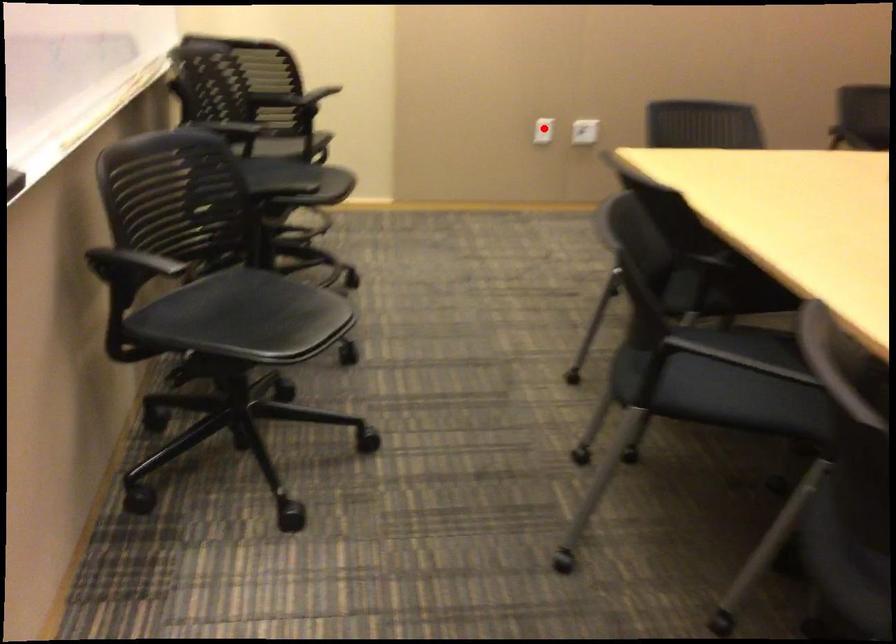
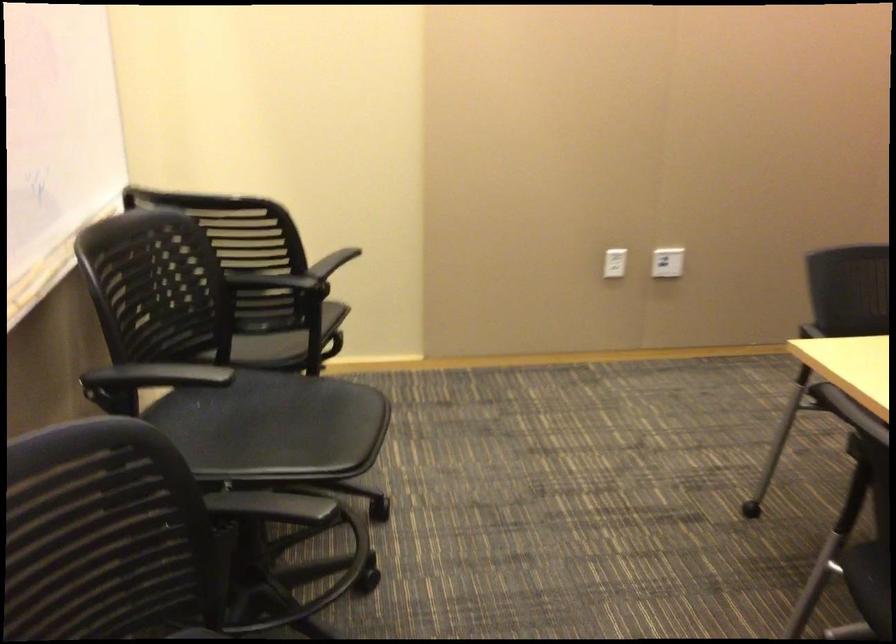
Question: A red point is marked in image1. In image2, is the corresponding 3D point closer to the camera or farther? Reply with the corresponding letter.

Choices:
 (A) The corresponding 3D point is closer.
 (B) The corresponding 3D point is farther.

Answer: (A)